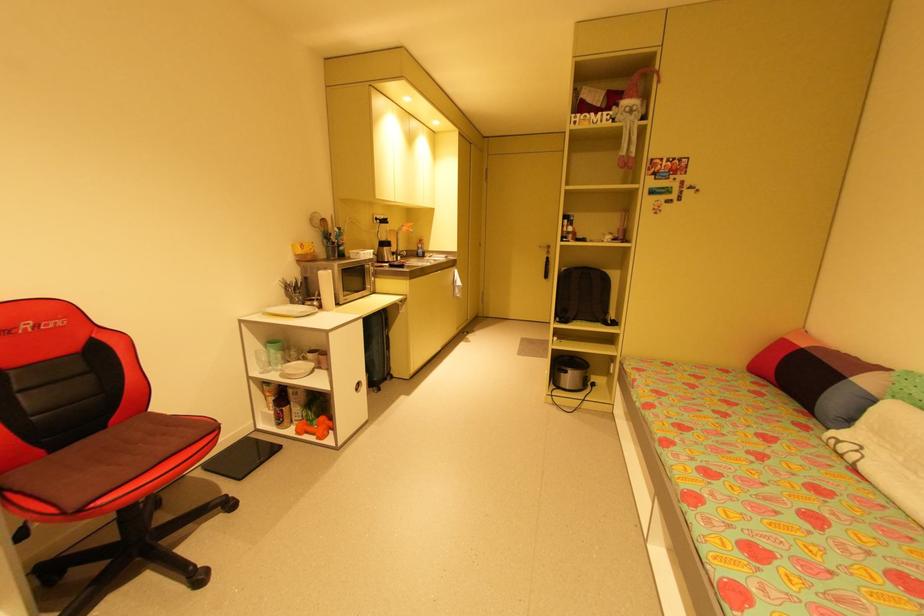
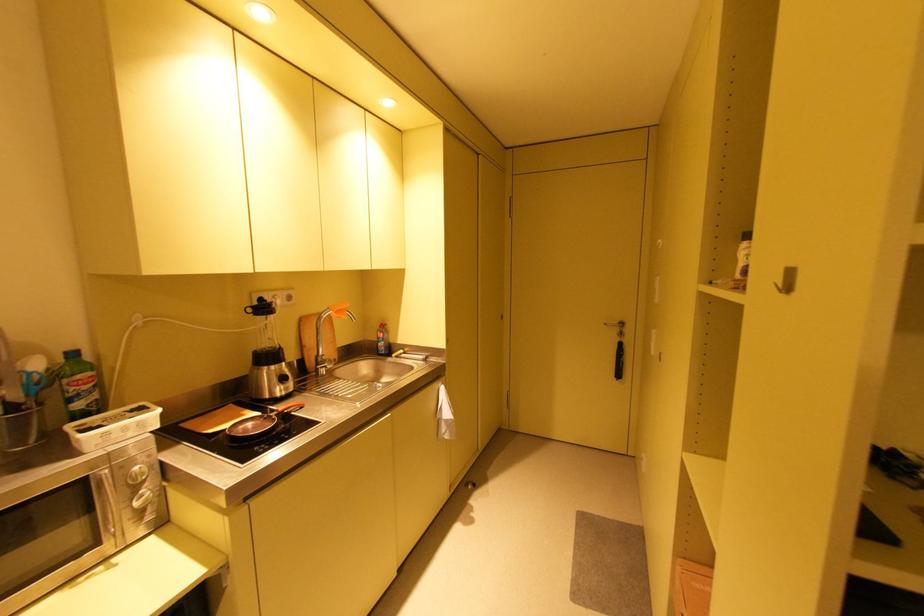
Question: Which direction would the cameraman need to move to produce the second image? Reply with the corresponding letter.

Choices:
 (A) Left
 (B) Right
 (C) Forward
 (D) Backward

Answer: (C)